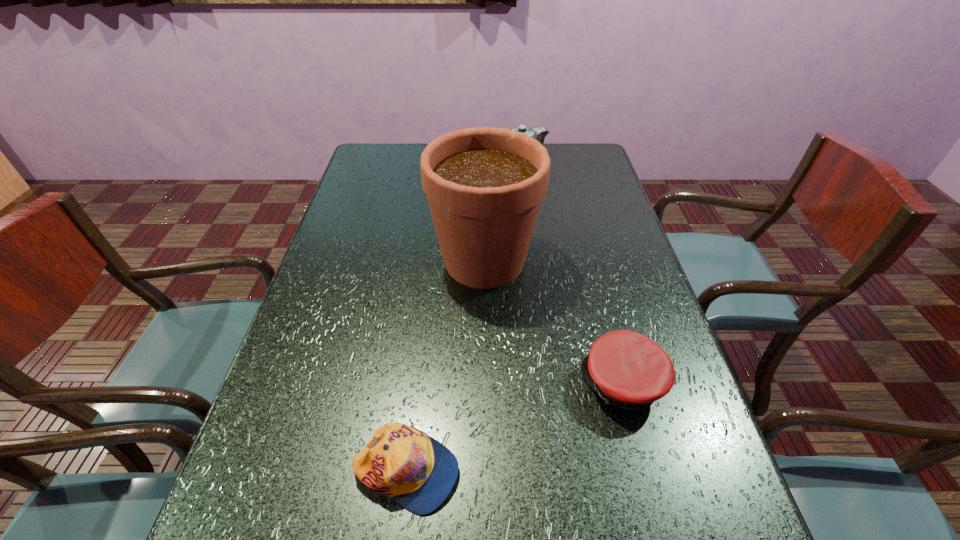
Identify the location of blank space located from the spout of the second tallest object. (472, 161).

Identify the location of free location located 0.060m from the spout of the second tallest object. (472, 161).

Find the location of `vacant space located on the front-facing side of the right cap`. vacant space located on the front-facing side of the right cap is located at coordinates (511, 383).

The height and width of the screenshot is (540, 960). Identify the location of free spot located 0.350m on the front-facing side of the right cap. (413, 383).

Locate an element on the screen. This screenshot has height=540, width=960. vacant space located on the front-facing side of the right cap is located at coordinates (413, 383).

The image size is (960, 540). I want to click on vacant space located 0.300m on the bill of the left cap, so click(629, 471).

The image size is (960, 540). Find the location of `object located in the far edge section of the desktop`. object located in the far edge section of the desktop is located at coordinates (539, 133).

This screenshot has width=960, height=540. In order to click on object located in the right edge section of the desktop in this screenshot , I will do `click(628, 370)`.

This screenshot has width=960, height=540. In the image, there is a desktop. Identify the location of vacant area at the left edge. (345, 275).

Where is `free space at the right edge of the desktop`? free space at the right edge of the desktop is located at coordinates (597, 228).